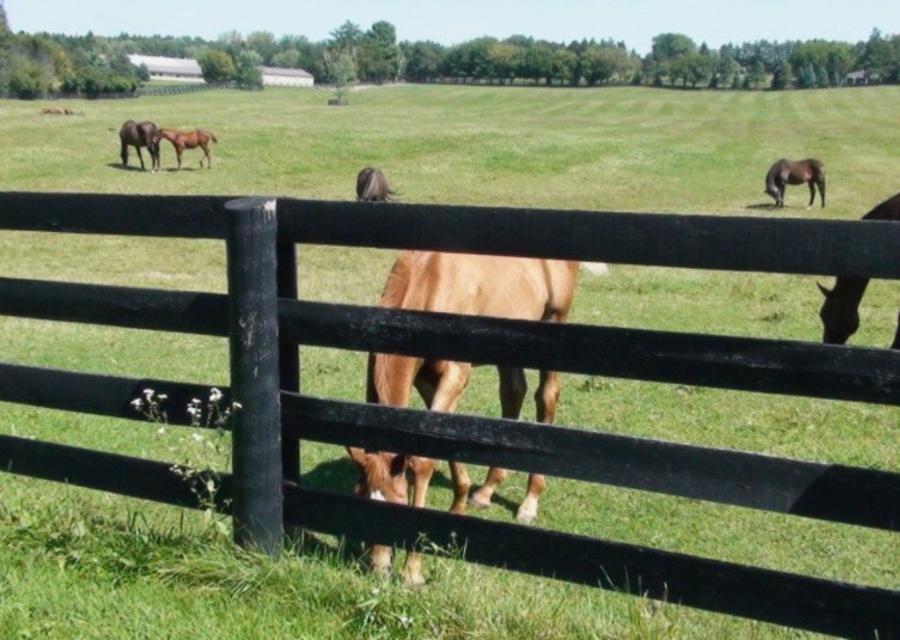
You are a farmer checking the pasture fence. You notice two horses near the fence. The brown glossy horse at center and the light brown horse at center. Which horse is wider?

The light brown horse at center is wider than the brown glossy horse at center.

You are standing in front of the pasture fence and want to determine which of the two points, point (776, 392) or point (173, 131), is closer to you. Based on the scene, which point is nearer?

Point (776, 392) is closer to the camera than point (173, 131), so it is the nearer point.

Looking at this image, you are a photographer trying to capture both the brown glossy horse at center and the brown glossy horse at upper left in a single frame. Based on their sizes in the image, which horse would appear closer to the camera?

The brown glossy horse at center appears closer to the camera because it is larger in size than the brown glossy horse at upper left.